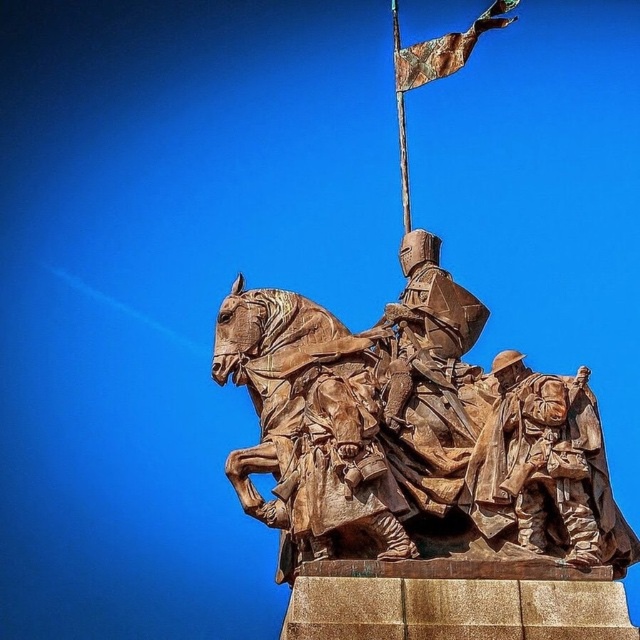
You are standing at the camera position and want to take a photo of the rustic bronze horse at center. If your camera has a maximum focus range of 200 feet, will you be able to capture the horse clearly?

The rustic bronze horse at center and camera are 216.18 feet apart, which exceeds the camera maximum focus range of 200 feet. Therefore, the camera cannot focus on the horse clearly.

You are a tour guide explaining the sculpture to visitors. You want to mention the distance between the rustic bronze soldiers at lower right and the rusty metal flag at upper center. How far apart are they?

The rustic bronze soldiers at lower right and the rusty metal flag at upper center are 33.89 meters apart.